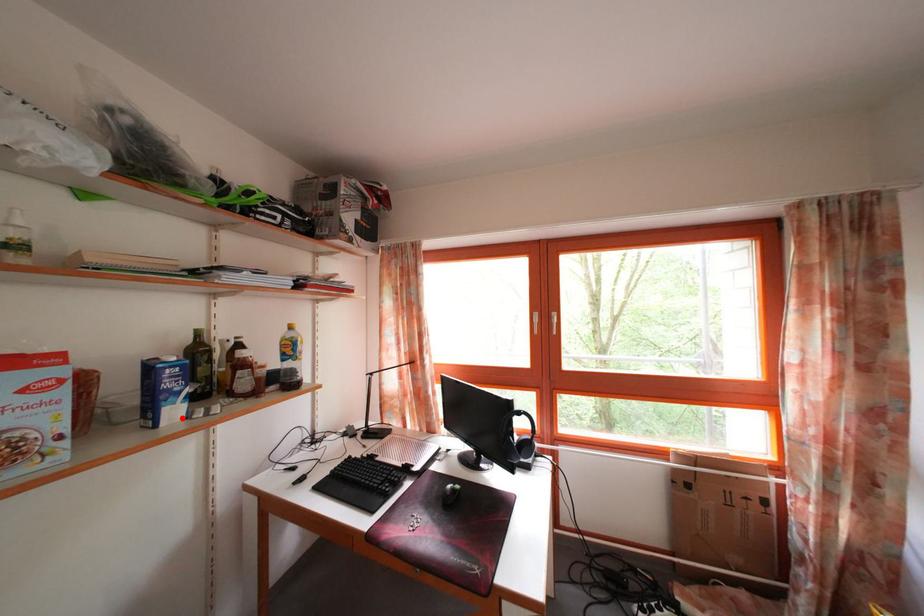
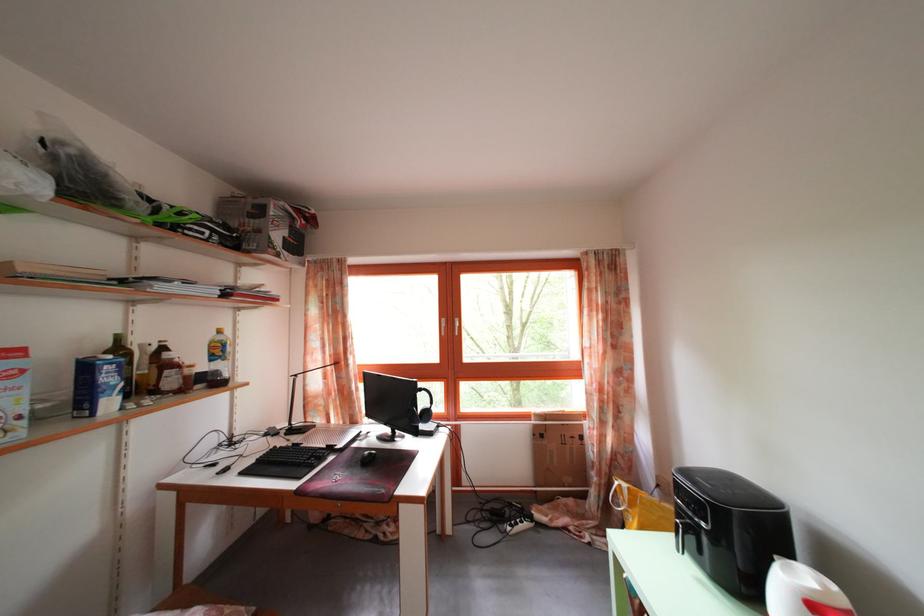
Locate, in the second image, the point that corresponds to the highlighted location in the first image.

(117, 410)